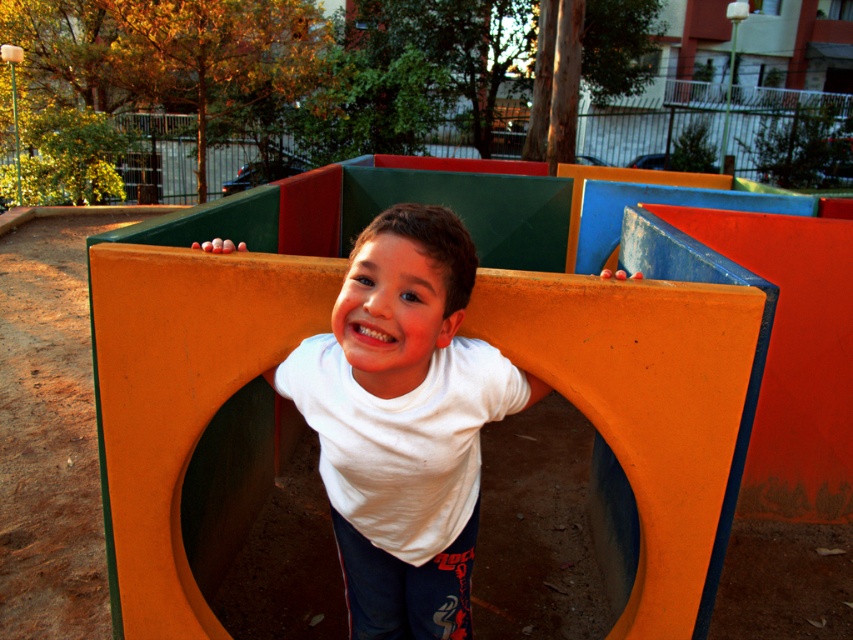
You are a parent trying to ensure your child stays safe while playing. Given the orange matte plastic at center and the white matte shirt at center, which object is more likely to be at a lower height, requiring closer supervision?

The orange matte plastic at center is shorter than the white matte shirt at center, so the orange matte plastic at center is at a lower height and requires closer supervision.

You are a photographer trying to capture the boy in the playground. You want to ensure that both the orange matte plastic at center and the white matte shirt at center are clearly visible in your photo. Given their sizes, which object should you focus on to make sure both are in frame?

Since the orange matte plastic at center is larger than the white matte shirt at center, you should focus on the orange matte plastic at center to ensure both objects are in frame as it takes up more space and will help frame the scene properly.

You are a parent watching your child at the playground. You notice the orange matte plastic at center and the white matte shirt at center. Which object is wider?

The orange matte plastic at center is wider than the white matte shirt at center.